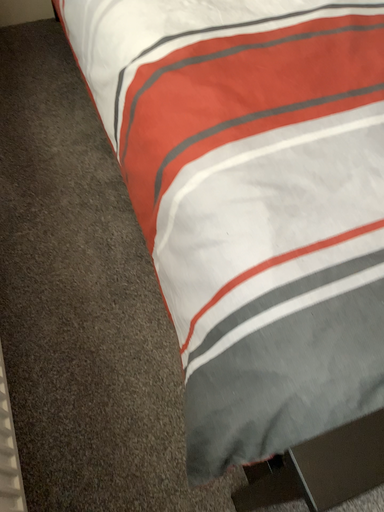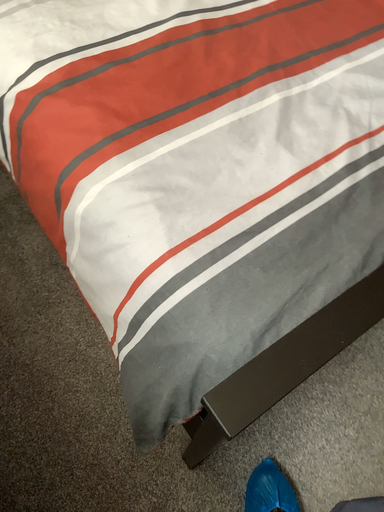
Question: How did the camera likely rotate when shooting the video?

Choices:
 (A) rotated left
 (B) rotated right

Answer: (B)